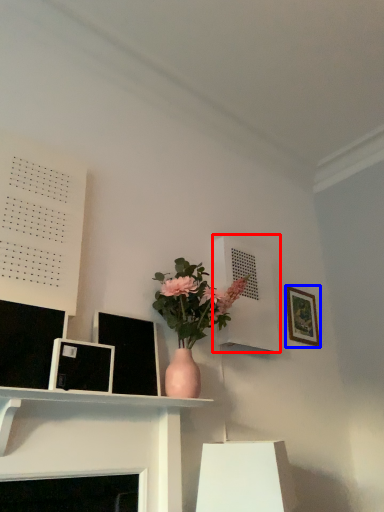
Question: Among these objects, which one is farthest to the camera, shelf (highlighted by a red box) or picture frame (highlighted by a blue box)?

Choices:
 (A) shelf
 (B) picture frame

Answer: (B)